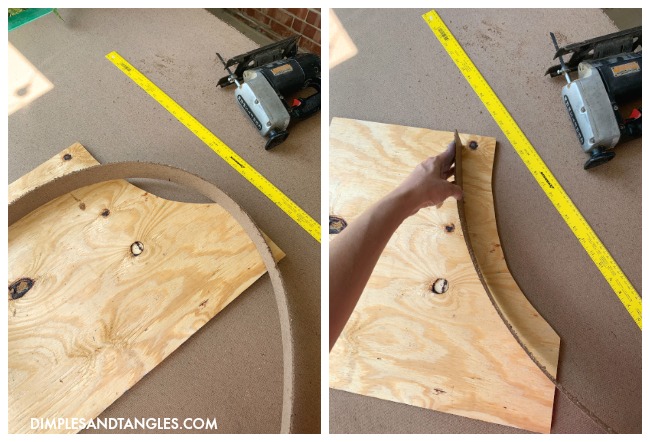
At what (x,y) coordinates should I click in order to perform the action: click on imperfections in wood. Please return your answer as a coordinate pair (x, y). Looking at the image, I should click on (437, 287), (450, 229), (333, 229), (470, 146), (140, 246), (105, 213), (64, 160), (21, 287).